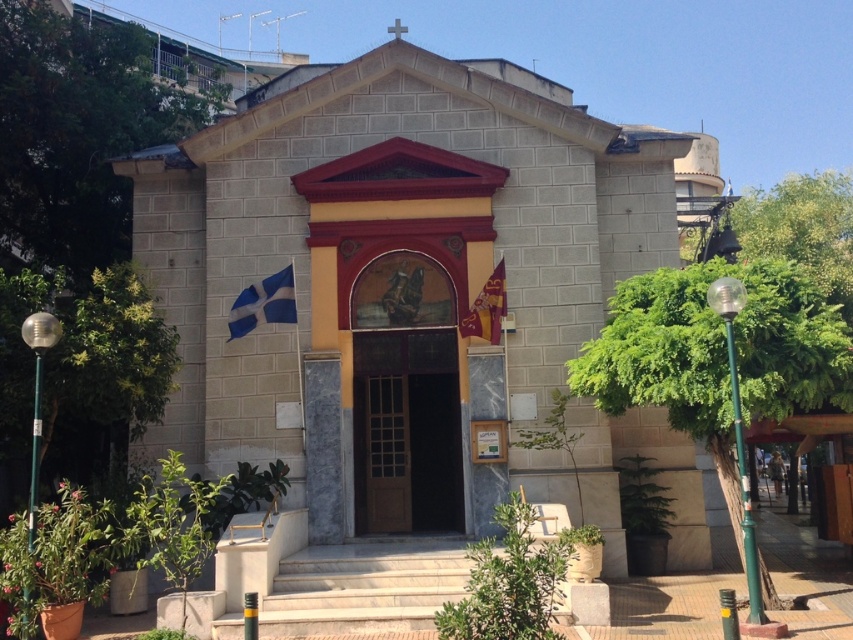
You are standing in front of the church and want to locate the green leafy tree at upper left. Based on the scene description, where would you look relative to the brown wooden door at center?

The green leafy tree at upper left is positioned above the brown wooden door at center, so you should look upward from the door to find it.

You are standing at the entrance of the gray stone chapel at center. What are the coordinates of the chapel?

The coordinates of the gray stone chapel at center are at point (410, 291).